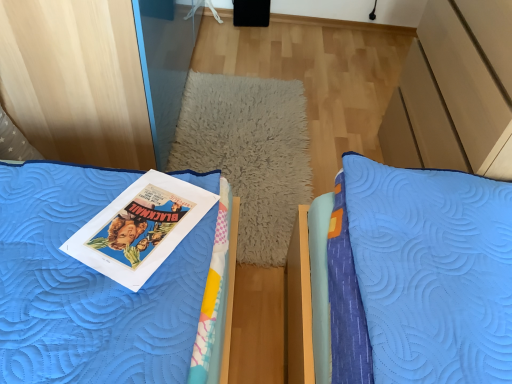
Question: Does white fluffy pillow at center lie in front of matte paper book at center?

Choices:
 (A) no
 (B) yes

Answer: (A)

Question: Does white fluffy pillow at center have a lesser width compared to matte paper book at center?

Choices:
 (A) yes
 (B) no

Answer: (B)

Question: Is white fluffy pillow at center oriented towards matte paper book at center?

Choices:
 (A) no
 (B) yes

Answer: (A)

Question: Would you consider white fluffy pillow at center to be distant from matte paper book at center?

Choices:
 (A) yes
 (B) no

Answer: (B)

Question: Is the position of white fluffy pillow at center more distant than that of matte paper book at center?

Choices:
 (A) yes
 (B) no

Answer: (A)

Question: Can you confirm if white fluffy pillow at center is taller than matte paper book at center?

Choices:
 (A) yes
 (B) no

Answer: (B)

Question: Can you confirm if matte paper book at center is taller than white fluffy pillow at center?

Choices:
 (A) yes
 (B) no

Answer: (A)

Question: From the image's perspective, would you say matte paper book at center is positioned over white fluffy pillow at center?

Choices:
 (A) yes
 (B) no

Answer: (B)

Question: Can you confirm if matte paper book at center is positioned to the left of white fluffy pillow at center?

Choices:
 (A) yes
 (B) no

Answer: (A)

Question: Considering the relative positions of matte paper book at center and white fluffy pillow at center in the image provided, is matte paper book at center to the right of white fluffy pillow at center from the viewer's perspective?

Choices:
 (A) yes
 (B) no

Answer: (B)

Question: From a real-world perspective, is matte paper book at center over white fluffy pillow at center?

Choices:
 (A) no
 (B) yes

Answer: (B)

Question: Can you confirm if matte paper book at center is wider than white fluffy pillow at center?

Choices:
 (A) yes
 (B) no

Answer: (B)

Question: From the image's perspective, is white fluffy pillow at center positioned above or below matte paper book at center?

Choices:
 (A) below
 (B) above

Answer: (B)